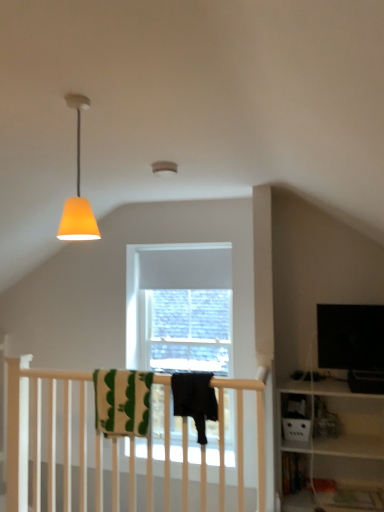
Question: From the image's perspective, would you say green striped towel at center, which is counted as the second beach towel, starting from the right, is positioned over orange matte lampshade at upper left?

Choices:
 (A) yes
 (B) no

Answer: (B)

Question: From a real-world perspective, is green striped towel at center, the 1th beach towel in the left-to-right sequence, positioned under orange matte lampshade at upper left based on gravity?

Choices:
 (A) no
 (B) yes

Answer: (B)

Question: Is green striped towel at center, which is counted as the second beach towel, starting from the right, not close to orange matte lampshade at upper left?

Choices:
 (A) yes
 (B) no

Answer: (A)

Question: Can you confirm if green striped towel at center, the 1th beach towel in the left-to-right sequence, is taller than orange matte lampshade at upper left?

Choices:
 (A) no
 (B) yes

Answer: (A)

Question: Is green striped towel at center, the 1th beach towel in the left-to-right sequence, positioned before orange matte lampshade at upper left?

Choices:
 (A) yes
 (B) no

Answer: (B)

Question: From their relative heights in the image, would you say black cotton towel at center, placed as the 2th beach towel when sorted from left to right, is taller or shorter than green striped towel at center, which is counted as the second beach towel, starting from the right?

Choices:
 (A) tall
 (B) short

Answer: (B)

Question: Considering the positions of point (177, 411) and point (109, 385), is point (177, 411) closer or farther from the camera than point (109, 385)?

Choices:
 (A) closer
 (B) farther

Answer: (A)

Question: Considering their positions, is black cotton towel at center, placed as the 2th beach towel when sorted from left to right, located in front of or behind green striped towel at center, which is counted as the second beach towel, starting from the right?

Choices:
 (A) behind
 (B) front

Answer: (B)

Question: From the image's perspective, is black cotton towel at center, placed as the 2th beach towel when sorted from left to right, positioned above or below green striped towel at center, the 1th beach towel in the left-to-right sequence?

Choices:
 (A) above
 (B) below

Answer: (A)

Question: Looking at the image, does orange matte lampshade at upper left seem bigger or smaller compared to black cotton towel at center, placed as the 2th beach towel when sorted from left to right?

Choices:
 (A) small
 (B) big

Answer: (A)

Question: Visually, is orange matte lampshade at upper left positioned to the left or to the right of black cotton towel at center, acting as the 1th beach towel starting from the right?

Choices:
 (A) right
 (B) left

Answer: (B)

Question: From a real-world perspective, relative to black cotton towel at center, acting as the 1th beach towel starting from the right, is orange matte lampshade at upper left vertically above or below?

Choices:
 (A) below
 (B) above

Answer: (B)

Question: Does point (67, 97) appear closer or farther from the camera than point (178, 404)?

Choices:
 (A) farther
 (B) closer

Answer: (B)

Question: Is orange matte lampshade at upper left inside or outside of green striped towel at center, which is counted as the second beach towel, starting from the right?

Choices:
 (A) outside
 (B) inside

Answer: (A)

Question: Relative to green striped towel at center, the 1th beach towel in the left-to-right sequence, is orange matte lampshade at upper left in front or behind?

Choices:
 (A) front
 (B) behind

Answer: (A)